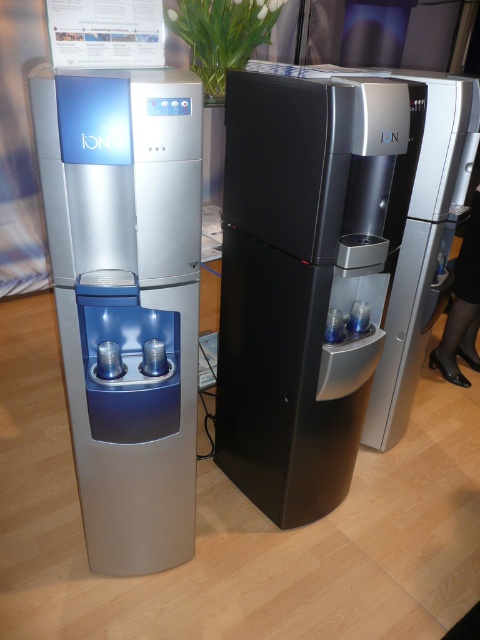
You are standing in a showroom and need to locate the black matte water cooler at center. According to the coordinates provided, where exactly is it positioned in the image?

The black matte water cooler at center is located at the coordinates point (305, 276).

You are a customer in the showroom and want to place a new dispenser between the black matte water cooler at center and the satin silver water dispenser at left. Can you do this without moving either existing dispenser?

The black matte water cooler at center is positioned on the right side of the satin silver water dispenser at left, meaning there is no space between them. Therefore, you cannot place a new dispenser between them without moving either existing dispenser.

You are an interior designer planning to place a 1.8m tall sculpture between the black matte water cooler at center and the satin silver water dispenser at left. Based on their heights, will the sculpture be taller than both?

The satin silver water dispenser at left is taller than the black matte water cooler at center. Since the sculpture is 1.8m tall, it will be taller than both if the satin silver water dispenser at left is shorter than 1.8m. However, without knowing the exact height of the satin silver water dispenser at left, we cannot definitively answer. However, according to the description, the black matte water cooler at center is shorter, so the sculpture will definitely be taller than the black matte water cooler at.